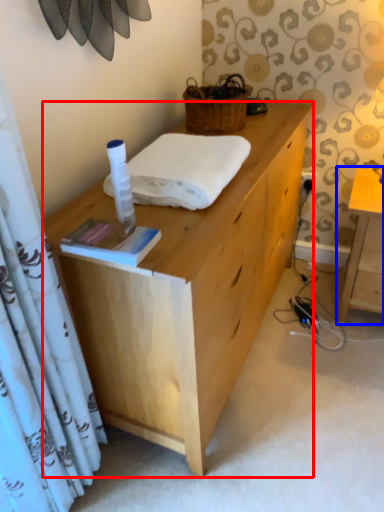
Question: Which point is further to the camera, desk (highlighted by a red box) or table (highlighted by a blue box)?

Choices:
 (A) desk
 (B) table

Answer: (B)